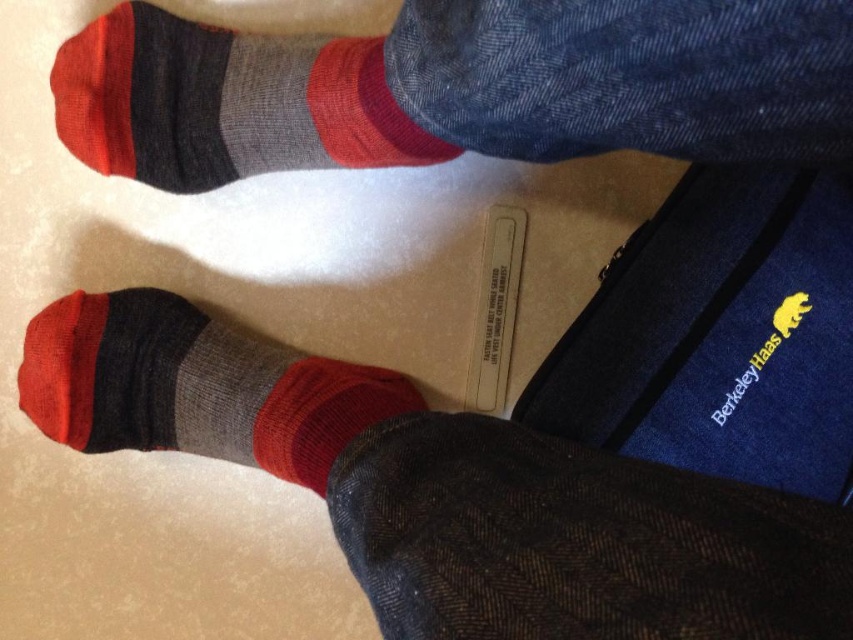
Question: Can you confirm if knit wool socks at center is positioned below knit wool socks at upper left?

Choices:
 (A) no
 (B) yes

Answer: (B)

Question: Which point appears closest to the camera in this image?

Choices:
 (A) (511, 556)
 (B) (82, 161)
 (C) (283, 429)

Answer: (A)

Question: Can you confirm if knit wool socks at upper left is positioned to the right of knit wool sock at lower left?

Choices:
 (A) yes
 (B) no

Answer: (A)

Question: Which of the following is the farthest from the observer?

Choices:
 (A) pos(366,426)
 (B) pos(364,400)

Answer: (B)

Question: In this image, where is knit wool socks at upper left located relative to knit wool sock at lower left?

Choices:
 (A) above
 (B) below

Answer: (A)

Question: Estimate the real-world distances between objects in this image. Which object is closer to the knit wool socks at upper left?

Choices:
 (A) knit wool socks at center
 (B) knit wool sock at lower left

Answer: (B)